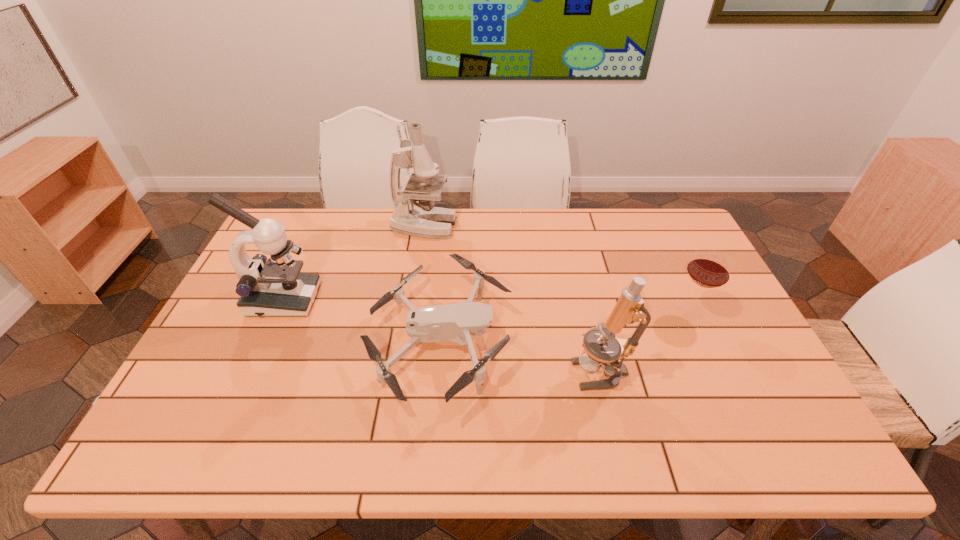
The image size is (960, 540). What are the coordinates of `vacant space at the left edge of the desktop` in the screenshot? It's located at (266, 338).

This screenshot has height=540, width=960. What are the coordinates of `free point at the right edge` in the screenshot? It's located at (714, 376).

This screenshot has width=960, height=540. In the image, there is a desktop. What are the coordinates of `vacant space at the far left corner` in the screenshot? It's located at (309, 247).

The image size is (960, 540). I want to click on vacant space at the near left corner of the desktop, so click(222, 438).

The width and height of the screenshot is (960, 540). I want to click on vacant space at the far right corner of the desktop, so click(x=663, y=235).

At what (x,y) coordinates should I click in order to perform the action: click on free region at the near right corner of the desktop. Please return your answer as a coordinate pair (x, y). Image resolution: width=960 pixels, height=540 pixels. Looking at the image, I should click on (795, 456).

The width and height of the screenshot is (960, 540). Identify the location of vacant point located between the second microscope from right to left and the fourth object from left to right. (513, 299).

The image size is (960, 540). Find the location of `vacant area that lies between the nearest microscope and the farthest microscope`. vacant area that lies between the nearest microscope and the farthest microscope is located at coordinates (513, 299).

Find the location of `vacant area between the wineglass and the shortest object`. vacant area between the wineglass and the shortest object is located at coordinates (565, 327).

This screenshot has width=960, height=540. What are the coordinates of `free area in between the farthest microscope and the nearest microscope` in the screenshot? It's located at (513, 299).